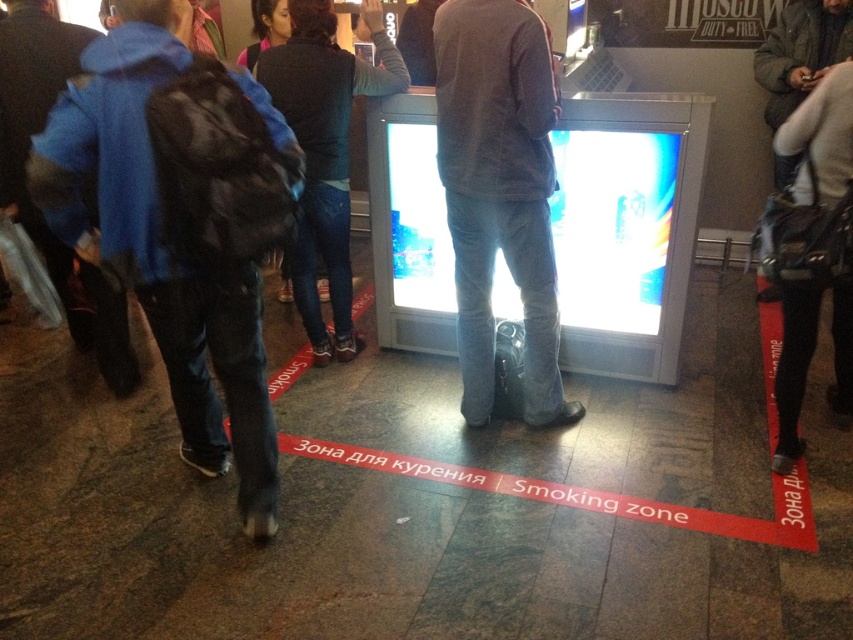
Can you confirm if matte blue jacket at left is positioned to the left of dark gray sweater at center?

Yes, matte blue jacket at left is to the left of dark gray sweater at center.

Looking at this image, can you confirm if matte blue jacket at left is shorter than dark gray sweater at center?

Incorrect, matte blue jacket at left's height does not fall short of dark gray sweater at center's.

Locate an element on the screen. This screenshot has height=640, width=853. matte blue jacket at left is located at coordinates (180, 221).

Is matte blue jacket at left taller than dark blue jeans at center?

Indeed, matte blue jacket at left has a greater height compared to dark blue jeans at center.

Describe the element at coordinates (180, 221) in the screenshot. This screenshot has height=640, width=853. I see `matte blue jacket at left` at that location.

This screenshot has height=640, width=853. Identify the location of matte blue jacket at left. [180, 221].

Is dark gray sweater at center thinner than dark blue jeans at center?

Correct, dark gray sweater at center's width is less than dark blue jeans at center's.

Image resolution: width=853 pixels, height=640 pixels. Describe the element at coordinates (498, 192) in the screenshot. I see `dark gray sweater at center` at that location.

At what (x,y) coordinates should I click in order to perform the action: click on dark gray sweater at center. Please return your answer as a coordinate pair (x, y). Image resolution: width=853 pixels, height=640 pixels. Looking at the image, I should click on (498, 192).